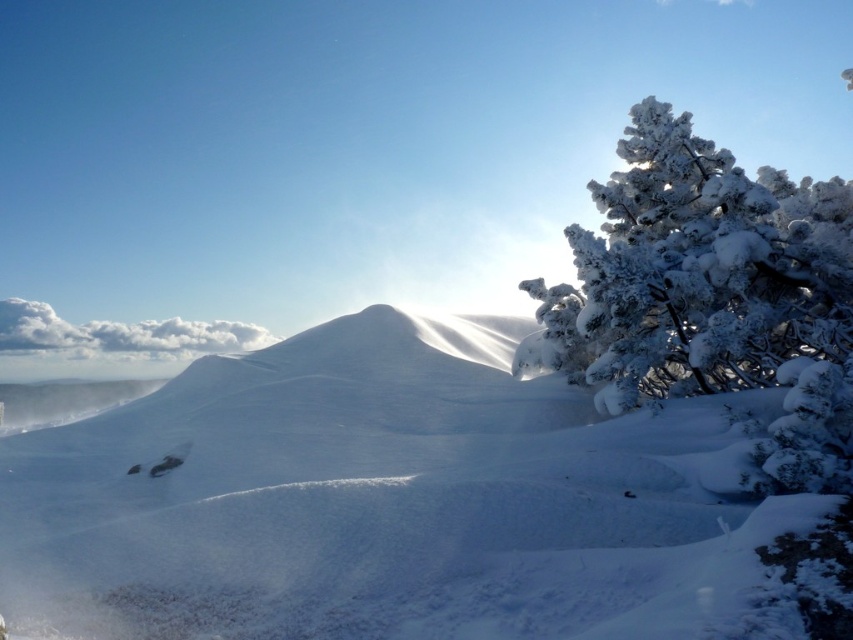
You are an artist planning to paint the winter scene. You want to ensure the white frosty tree at right and the white fluffy cloud at upper left are placed correctly according to their actual positions. Which object should be drawn on the right side of the other?

The white frosty tree at right is positioned on the right side of white fluffy cloud at upper left, so the tree should be drawn to the right of the cloud.

You are an artist sketching this winter scene. You want to ensure the white frosty tree at right and the white fluffy cloud at upper left are proportionally accurate. Which one should you draw smaller in your sketch?

The white frosty tree at right should be drawn smaller than the white fluffy cloud at upper left because the white frosty tree at right has a smaller size compared to white fluffy cloud at upper left.